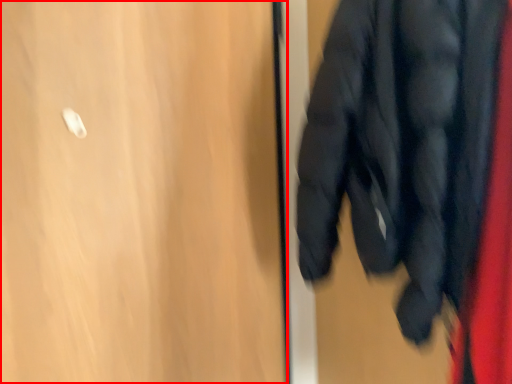
Question: From the image's perspective, what is the correct spatial positioning of door (annotated by the red box) in reference to jacket?

Choices:
 (A) above
 (B) below

Answer: (B)